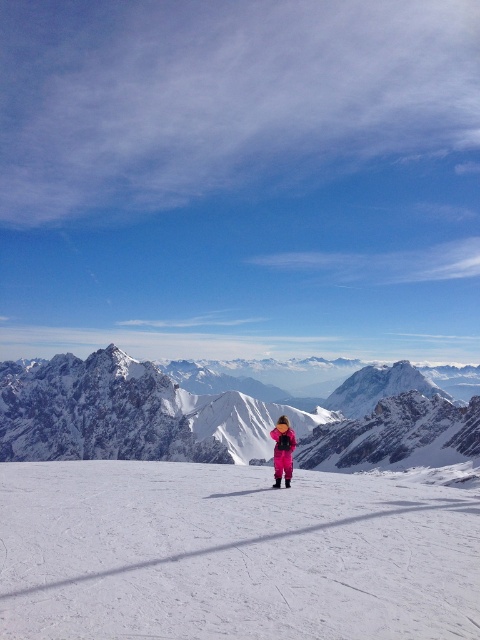
You are a photographer planning to take a photo of the snowy rocky mountain at center and the pink fabric ski at center in the winter landscape. To ensure both are in focus, you need to know their relative positions. Which object is closer to the camera?

The pink fabric ski at center is closer to the camera than the snowy rocky mountain at center because the snowy rocky mountain at center is further to the viewer.

You are standing in the snow and see the snowy rocky mountain at center. If you want to take a photo of it with your phone camera, which has a 12MP sensor, what is the pixel density per square meter of the mountain at its base?

The question cannot be accurately answered with the provided information. The 2D coordinates of the snowy rocky mountain at center do not provide sufficient data about its actual size or distance from the camera to calculate pixel density per square meter.